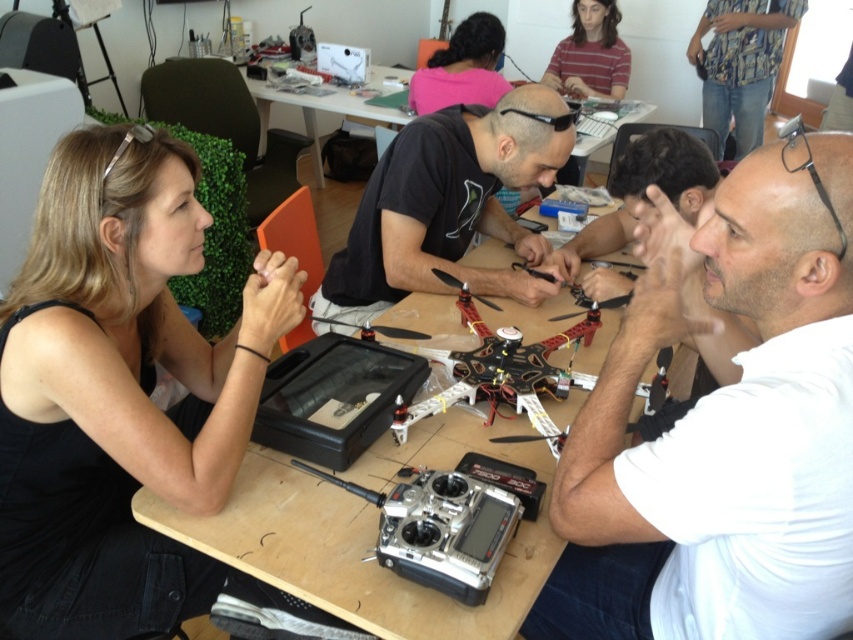
Locate an element on the screen. black matte shirt at center is located at coordinates (450, 204).

Is the position of black matte shirt at center more distant than that of pink fabric shirt at upper center?

No, black matte shirt at center is in front of pink fabric shirt at upper center.

Is point (523, 285) closer to viewer compared to point (471, 44)?

Yes, it is.

Find the location of a particular element. The image size is (853, 640). black matte shirt at center is located at coordinates (450, 204).

Can you confirm if white matte shirt at center is bigger than striped shirt at upper center?

Correct, white matte shirt at center is larger in size than striped shirt at upper center.

Can you confirm if white matte shirt at center is taller than striped shirt at upper center?

Correct, white matte shirt at center is much taller as striped shirt at upper center.

Is point (631, 333) more distant than point (607, 10)?

No, it is in front of (607, 10).

The image size is (853, 640). Identify the location of white matte shirt at center. (722, 426).

Between wooden table at center and black matte shirt at center, which one is positioned higher?

black matte shirt at center

Is point (434, 593) farther from camera compared to point (412, 186)?

No, (434, 593) is in front of (412, 186).

Identify the location of wooden table at center. The width and height of the screenshot is (853, 640). (367, 534).